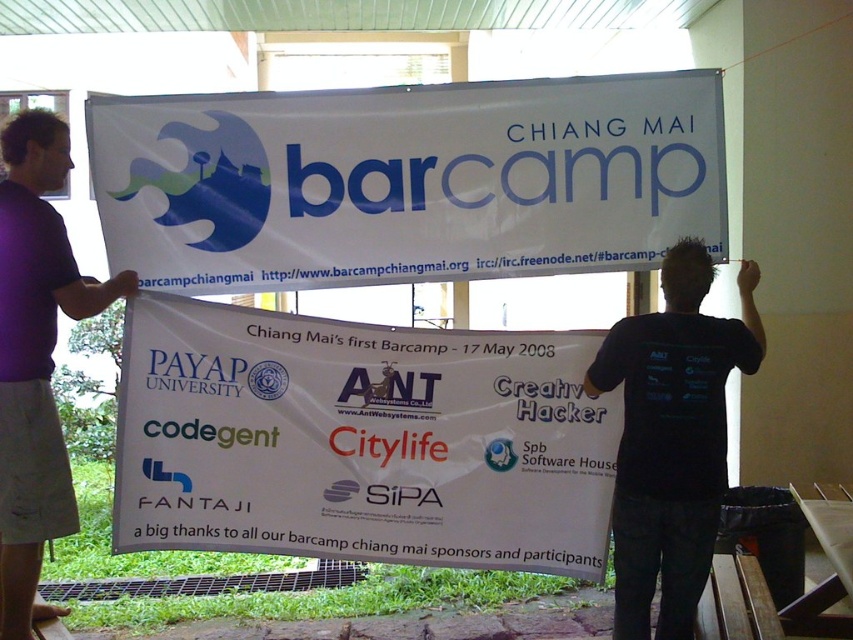
From the picture: You are standing in front of the banner and want to take a photo of the black fabric shirt at upper right. Where should you position yourself to capture the shirt in the frame?

The black fabric shirt at upper right is located at coordinates point (672, 438), so position yourself to aim your camera slightly to the right and upwards to capture it in the frame.